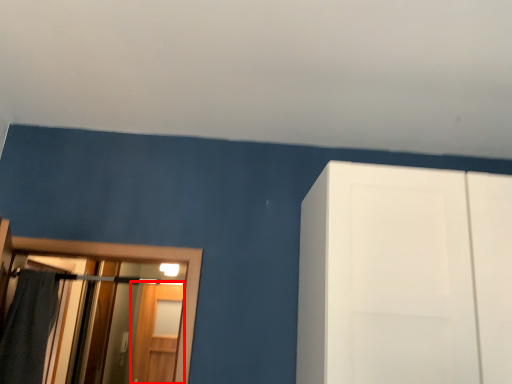
Question: From the image's perspective, where is screen door (annotated by the red box) located relative to bath towel?

Choices:
 (A) above
 (B) below

Answer: (B)